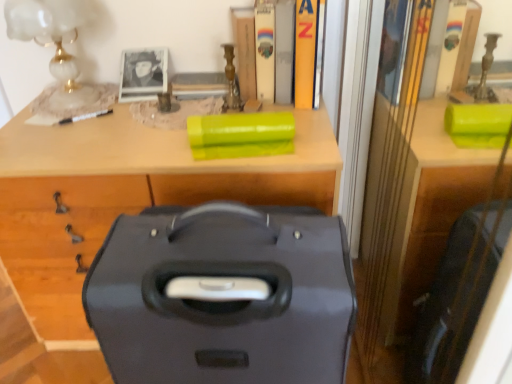
Question: Does wooden book at upper center, the 1th book positioned from the left, touch matte black suitcase at center?

Choices:
 (A) no
 (B) yes

Answer: (A)

Question: Considering the relative sizes of wooden book at upper center, which ranks as the fourth book in right-to-left order, and matte black suitcase at center in the image provided, is wooden book at upper center, which ranks as the fourth book in right-to-left order, bigger than matte black suitcase at center?

Choices:
 (A) yes
 (B) no

Answer: (B)

Question: From the image's perspective, is wooden book at upper center, the 1th book positioned from the left, over matte black suitcase at center?

Choices:
 (A) no
 (B) yes

Answer: (B)

Question: Is wooden book at upper center, the 1th book positioned from the left, positioned with its back to matte black suitcase at center?

Choices:
 (A) no
 (B) yes

Answer: (A)

Question: Is wooden book at upper center, the 1th book positioned from the left, thinner than matte black suitcase at center?

Choices:
 (A) no
 (B) yes

Answer: (B)

Question: Looking at the image, does matte black suitcase at center seem bigger or smaller compared to hardcover book at upper center, which is counted as the third book, starting from the right?

Choices:
 (A) big
 (B) small

Answer: (A)

Question: Is matte black suitcase at center inside or outside of hardcover book at upper center, which ranks as the 2th book in left-to-right order?

Choices:
 (A) outside
 (B) inside

Answer: (A)

Question: From a real-world perspective, relative to hardcover book at upper center, which ranks as the 2th book in left-to-right order, is matte black suitcase at center vertically above or below?

Choices:
 (A) above
 (B) below

Answer: (B)

Question: In terms of height, does matte black suitcase at center look taller or shorter compared to hardcover book at upper center, which is counted as the third book, starting from the right?

Choices:
 (A) tall
 (B) short

Answer: (A)

Question: Looking at their shapes, would you say yellow matte book at upper center, the fourth book positioned from the left, is wider or thinner than hardcover book at upper center, which ranks as the 2th book in left-to-right order?

Choices:
 (A) wide
 (B) thin

Answer: (A)

Question: Choose the correct answer: Is yellow matte book at upper center, the fourth book positioned from the left, inside hardcover book at upper center, which ranks as the 2th book in left-to-right order, or outside it?

Choices:
 (A) outside
 (B) inside

Answer: (A)

Question: From a real-world perspective, is yellow matte book at upper center, the first book viewed from the right, above or below hardcover book at upper center, which ranks as the 2th book in left-to-right order?

Choices:
 (A) above
 (B) below

Answer: (A)

Question: Is point (312, 94) positioned closer to the camera than point (268, 46)?

Choices:
 (A) farther
 (B) closer

Answer: (A)

Question: From the image's perspective, is hardcover book at upper center, which is counted as the second book, starting from the right, above or below matte black suitcase at center?

Choices:
 (A) below
 (B) above

Answer: (B)

Question: Is hardcover book at upper center, which is counted as the second book, starting from the right, wider or thinner than matte black suitcase at center?

Choices:
 (A) wide
 (B) thin

Answer: (B)